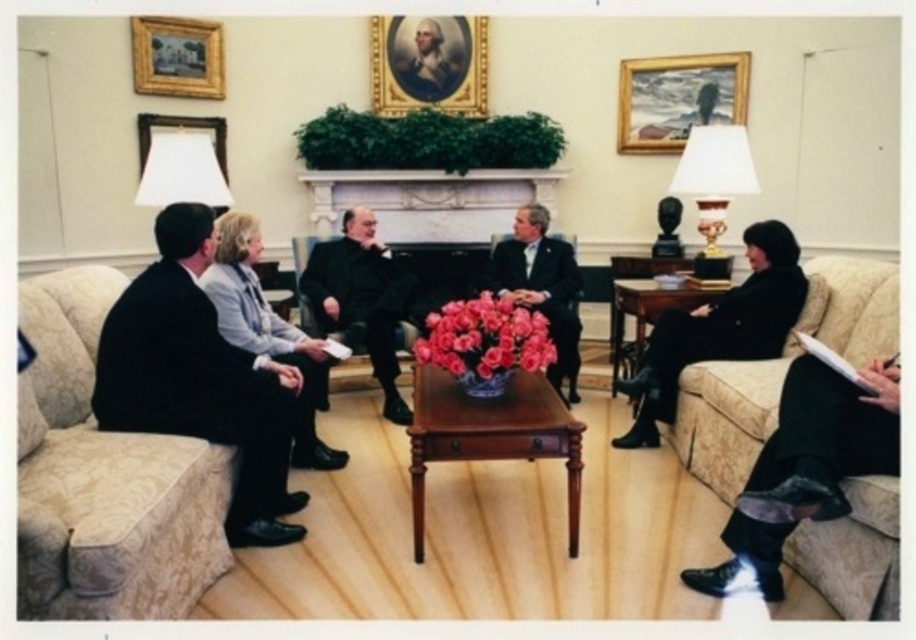
Is point (108, 572) in front of point (778, 548)?

Yes, it is in front of point (778, 548).

Is beige fabric couch at left wider than velvet beige couch at right?

Incorrect, beige fabric couch at left's width does not surpass velvet beige couch at right's.

Who is more distant from viewer, (56, 476) or (878, 305)?

Positioned behind is point (878, 305).

Locate an element on the screen. The width and height of the screenshot is (916, 640). beige fabric couch at left is located at coordinates (106, 477).

Is the position of mahogany wooden table at center less distant than that of wooden coffee table at center?

Yes, it is.

Who is positioned more to the right, mahogany wooden table at center or wooden coffee table at center?

wooden coffee table at center is more to the right.

I want to click on mahogany wooden table at center, so click(x=489, y=435).

Between beige fabric couch at left and mahogany wooden table at center, which one appears on the left side from the viewer's perspective?

beige fabric couch at left is more to the left.

Which of these two, beige fabric couch at left or mahogany wooden table at center, stands shorter?

mahogany wooden table at center is shorter.

What do you see at coordinates (106, 477) in the screenshot? This screenshot has width=916, height=640. I see `beige fabric couch at left` at bounding box center [106, 477].

Where is `beige fabric couch at left`? The height and width of the screenshot is (640, 916). beige fabric couch at left is located at coordinates (106, 477).